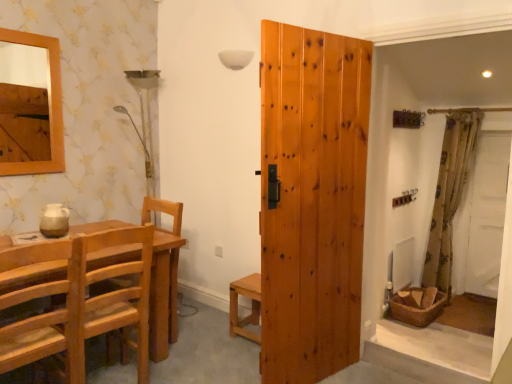
Question: Is light brown wooden chair at left, placed as the 2th chair when sorted from front to back, oriented towards natural wood door at center?

Choices:
 (A) no
 (B) yes

Answer: (A)

Question: Does light brown wooden chair at left, placed as the 2th chair when sorted from front to back, have a smaller size compared to natural wood door at center?

Choices:
 (A) no
 (B) yes

Answer: (B)

Question: Can you confirm if light brown wooden chair at left, the 1th chair when ordered from back to front, is bigger than natural wood door at center?

Choices:
 (A) no
 (B) yes

Answer: (A)

Question: Does light brown wooden chair at left, placed as the 2th chair when sorted from front to back, appear on the left side of natural wood door at center?

Choices:
 (A) yes
 (B) no

Answer: (A)

Question: From a real-world perspective, is light brown wooden chair at left, the 1th chair when ordered from back to front, on top of natural wood door at center?

Choices:
 (A) yes
 (B) no

Answer: (B)

Question: From the image's perspective, is light brown wooden chair at left, placed as the 2th chair when sorted from front to back, on top of natural wood door at center?

Choices:
 (A) yes
 (B) no

Answer: (B)

Question: Can you confirm if natural wood chair at left is thinner than natural wood door at center?

Choices:
 (A) no
 (B) yes

Answer: (A)

Question: Is natural wood chair at left behind natural wood door at center?

Choices:
 (A) yes
 (B) no

Answer: (A)

Question: Does natural wood chair at left appear on the left side of natural wood door at center?

Choices:
 (A) no
 (B) yes

Answer: (B)

Question: From a real-world perspective, is natural wood chair at left under natural wood door at center?

Choices:
 (A) yes
 (B) no

Answer: (A)

Question: Is natural wood chair at left shorter than natural wood door at center?

Choices:
 (A) no
 (B) yes

Answer: (B)

Question: Is natural wood chair at left next to natural wood door at center?

Choices:
 (A) yes
 (B) no

Answer: (B)

Question: Considering the relative positions of floral fabric curtain at right and white fabric screen door at right in the image provided, is floral fabric curtain at right to the left of white fabric screen door at right from the viewer's perspective?

Choices:
 (A) yes
 (B) no

Answer: (A)